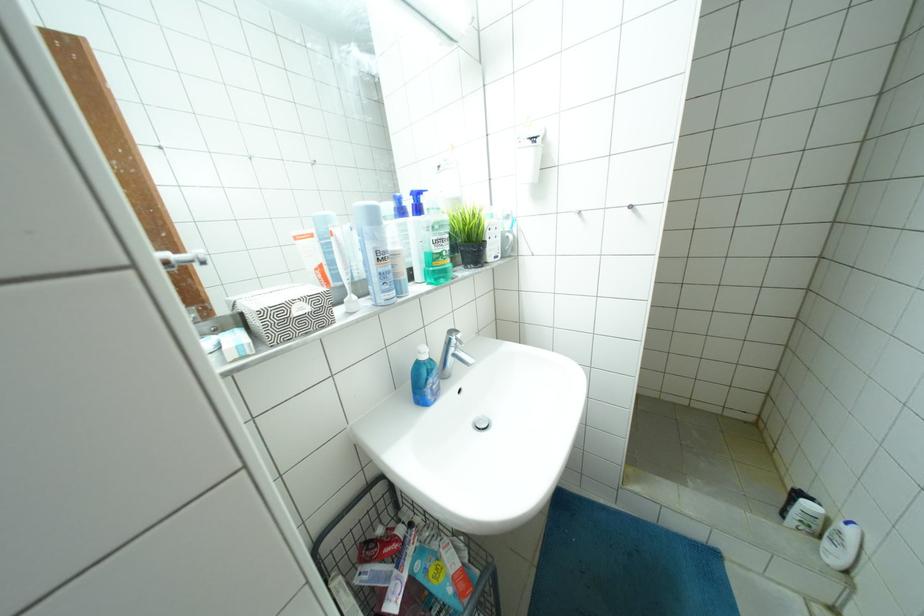
Where would you push the sink drain plug? Please return your answer as a coordinate pair (x, y).

(480, 423)